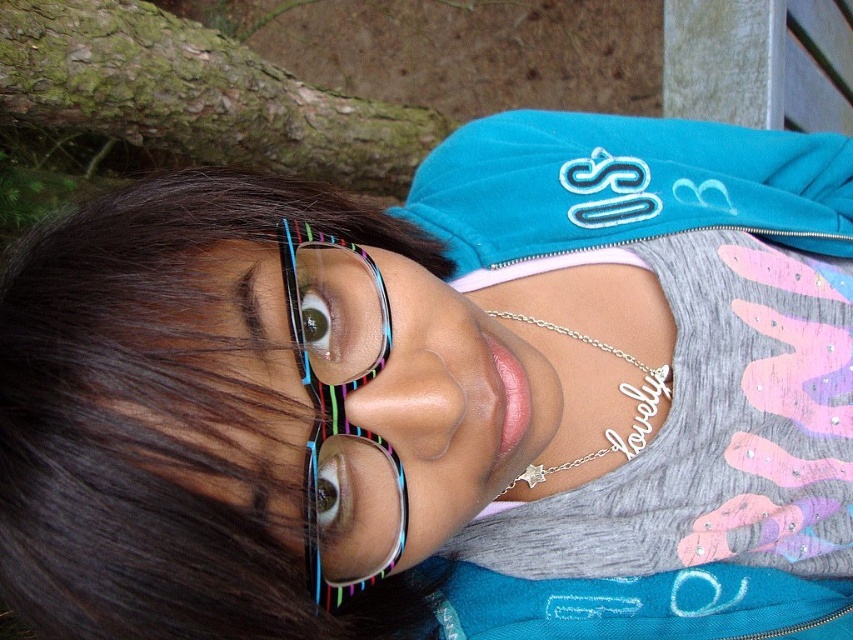
Question: Does multicolored plastic glasses at upper left have a lesser width compared to rainbow striped glasses at center?

Choices:
 (A) yes
 (B) no

Answer: (B)

Question: Which object is farther from the camera taking this photo?

Choices:
 (A) multicolored plastic glasses at upper left
 (B) rainbow striped glasses at center

Answer: (B)

Question: Which point is farther to the camera?

Choices:
 (A) multicolored plastic glasses at upper left
 (B) rainbow striped glasses at center

Answer: (B)

Question: Is multicolored plastic glasses at upper left bigger than rainbow striped glasses at center?

Choices:
 (A) no
 (B) yes

Answer: (B)

Question: Which of the following is the closest to the observer?

Choices:
 (A) rainbow striped glasses at center
 (B) multicolored plastic glasses at upper left

Answer: (B)

Question: Is multicolored plastic glasses at upper left further to camera compared to rainbow striped glasses at center?

Choices:
 (A) no
 (B) yes

Answer: (A)